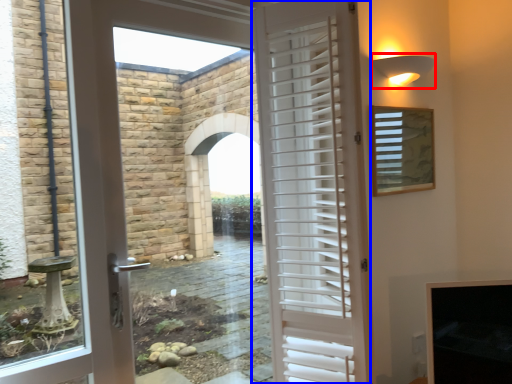
Question: Among these objects, which one is farthest to the camera, light fixture (highlighted by a red box) or door (highlighted by a blue box)?

Choices:
 (A) light fixture
 (B) door

Answer: (A)